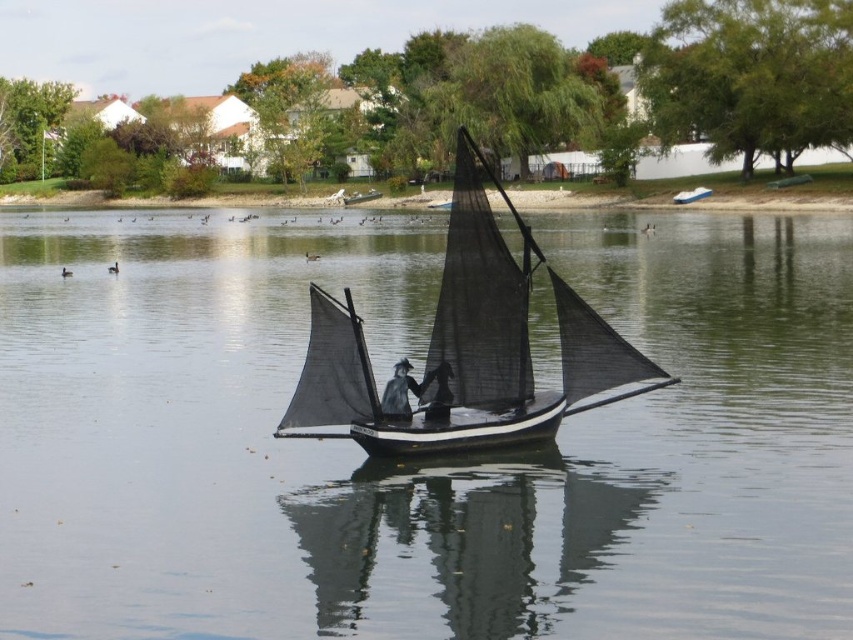
You are a swimmer who wants to reach the metallic blue sailboat at center from the transparent water at center. Given that you can swim at a speed of 2 meters per second, how long will it take you to reach the sailboat?

The distance between the transparent water at center and the metallic blue sailboat at center is 31.52 meters. At a swimming speed of 2 meters per second, it would take approximately 15.76 seconds to reach the sailboat.

You are a photographer trying to capture the black mesh sailboat at center and the dark gray fabric hat at center in a single frame. Since you want to emphasize the sailboat, which object should you focus on first and why?

The black mesh sailboat at center is bigger than the dark gray fabric hat at center, so focusing on the sailboat first will naturally draw attention due to its larger size, making it the focal point of the photo.